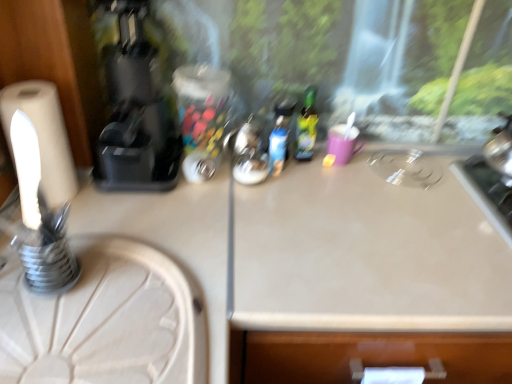
Find the location of a particular element. vacant region above white wood round table at lower left (from a real-world perspective) is located at coordinates (87, 300).